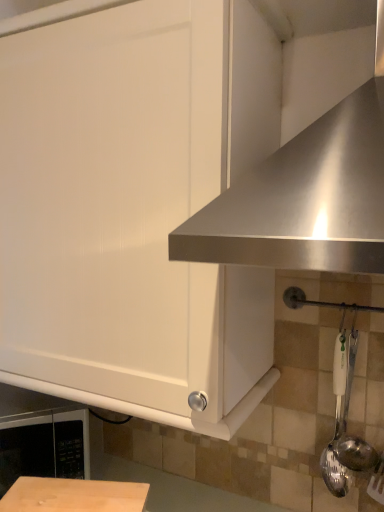
Question: Is point (339, 459) closer or farther from the camera than point (372, 187)?

Choices:
 (A) closer
 (B) farther

Answer: (B)

Question: Is white plastic spoon at lower right, which appears as the 1th utensil when viewed from the right, spatially inside stainless steel exhaust hood at upper right, or outside of it?

Choices:
 (A) outside
 (B) inside

Answer: (A)

Question: Based on their relative distances, which object is farther from the satin silver spoon at right, acting as the first utensil starting from the left?

Choices:
 (A) white plastic spoon at lower right, arranged as the second utensil when viewed from the left
 (B) white matte cabinet at upper left
 (C) stainless steel exhaust hood at upper right
 (D) black matte microwave at lower left

Answer: (D)

Question: Which object is positioned closest to the white matte cabinet at upper left?

Choices:
 (A) black matte microwave at lower left
 (B) stainless steel exhaust hood at upper right
 (C) white plastic spoon at lower right, arranged as the second utensil when viewed from the left
 (D) satin silver spoon at right, acting as the first utensil starting from the left

Answer: (B)